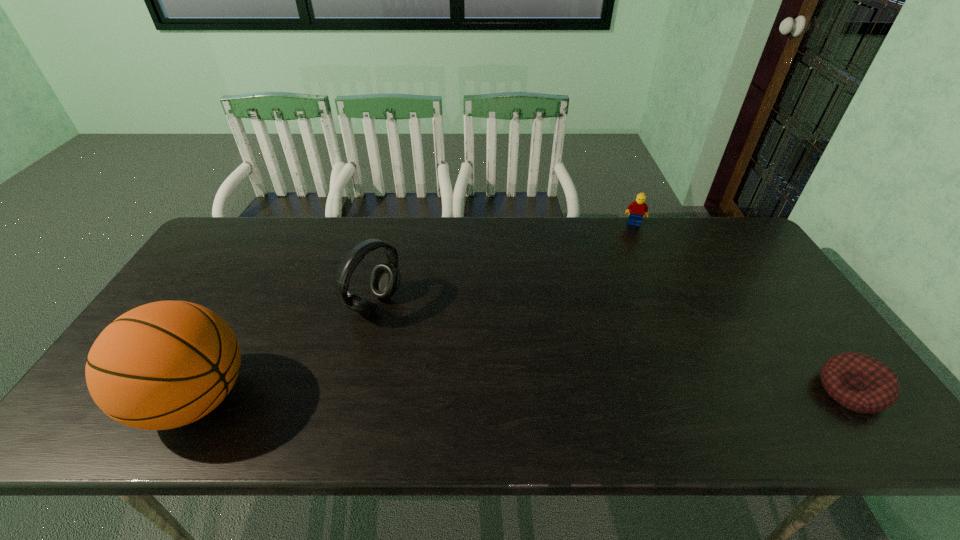
You are a GUI agent. You are given a task and a screenshot of the screen. Output one action in this format:
    pyautogui.click(x=<x>, y=<y>)
    Task: Click on the vacant space on the desktop that is between the leftmost object and the shortest object and is positioned on the earcups of the headset
    This screenshot has width=960, height=540.
    Given the screenshot: What is the action you would take?
    pyautogui.click(x=552, y=394)

You are a GUI agent. You are given a task and a screenshot of the screen. Output one action in this format:
    pyautogui.click(x=<x>, y=<y>)
    Task: Click on the vacant spot on the desktop that is between the leftmost object and the beanbag and is positioned on the front-facing side of the Lego
    The height and width of the screenshot is (540, 960).
    Given the screenshot: What is the action you would take?
    pyautogui.click(x=623, y=393)